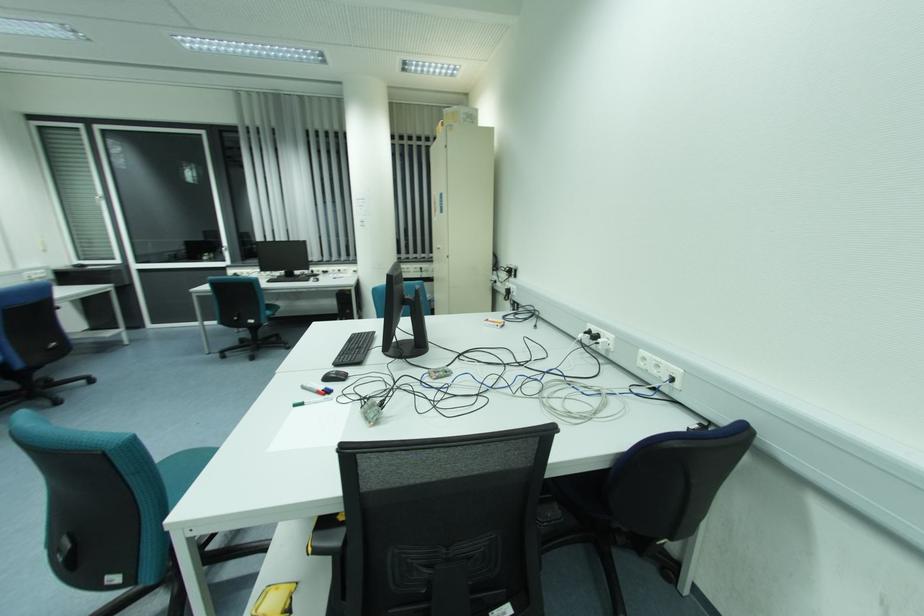
At what (x,y) coordinates should I click in order to perform the action: click on black power plug. Please return your answer as a coordinate pair (x, y). The width and height of the screenshot is (924, 616). Looking at the image, I should click on [589, 334].